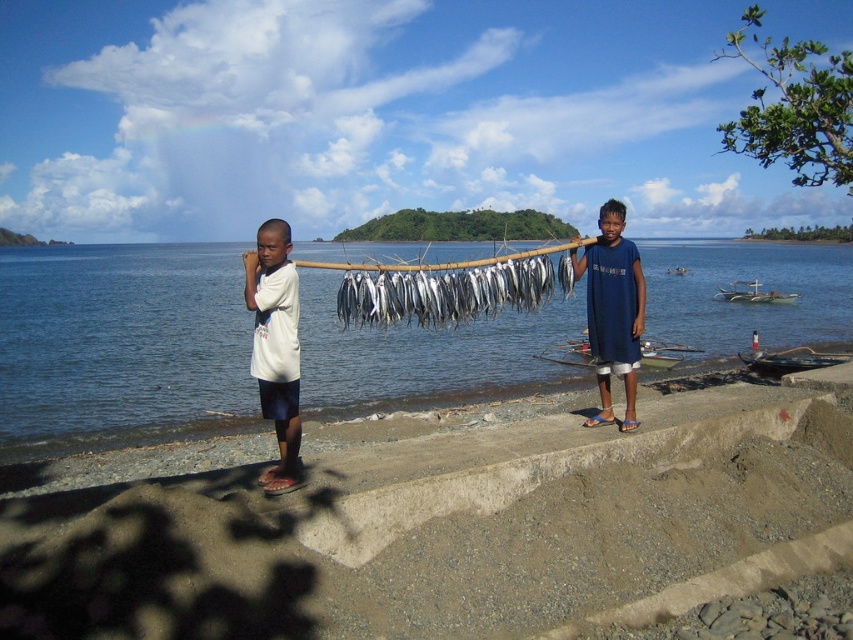
Is point (518, 262) farther from viewer compared to point (558, 282)?

No, it is not.

Between silver metallic fish at center and silvery metallic fish at center, which one has less height?

With less height is silvery metallic fish at center.

The width and height of the screenshot is (853, 640). Find the location of `silver metallic fish at center`. silver metallic fish at center is located at coordinates 444,291.

You are a GUI agent. You are given a task and a screenshot of the screen. Output one action in this format:
    pyautogui.click(x=<x>, y=<y>)
    Task: Click on the silver metallic fish at center
    Image resolution: width=853 pixels, height=640 pixels.
    Given the screenshot: What is the action you would take?
    pyautogui.click(x=444, y=291)

Can you confirm if blue water at center is positioned to the left of silvery metallic fish at center?

In fact, blue water at center is to the right of silvery metallic fish at center.

Can you confirm if blue water at center is wider than silvery metallic fish at center?

Correct, the width of blue water at center exceeds that of silvery metallic fish at center.

Is point (96, 381) behind point (556, 264)?

Yes, it is.

This screenshot has width=853, height=640. Identify the location of blue water at center. (120, 344).

Who is more forward, (x=321, y=365) or (x=270, y=477)?

Positioned in front is point (x=270, y=477).

Find the location of a particular element. blue water at center is located at coordinates (120, 344).

This screenshot has width=853, height=640. What do you see at coordinates (120, 344) in the screenshot? I see `blue water at center` at bounding box center [120, 344].

Locate an element on the screen. Image resolution: width=853 pixels, height=640 pixels. blue water at center is located at coordinates [x=120, y=344].